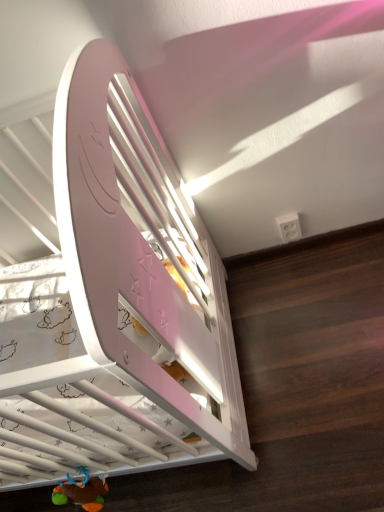
Question: Should I look upward or downward to see plush multicolored toy at lower left?

Choices:
 (A) up
 (B) down

Answer: (B)